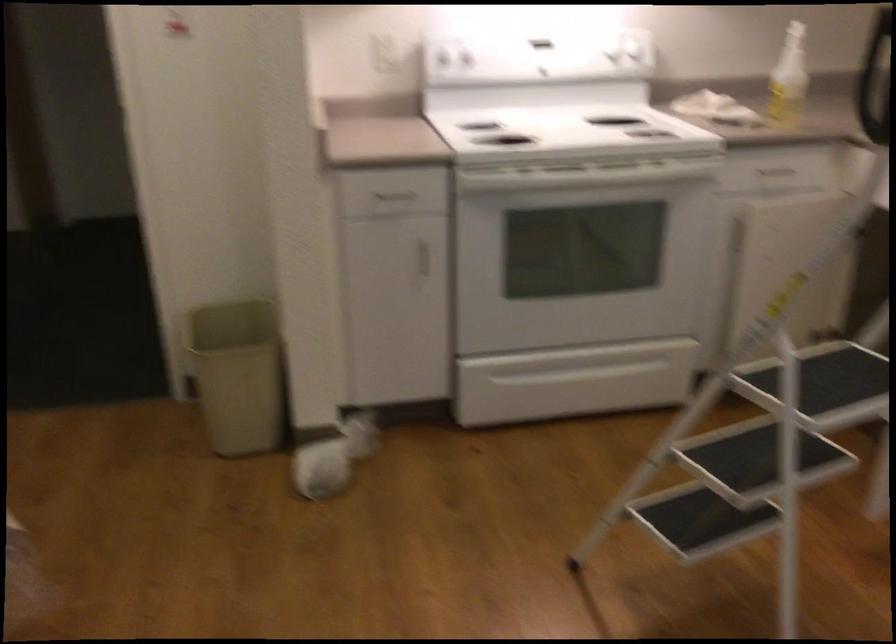
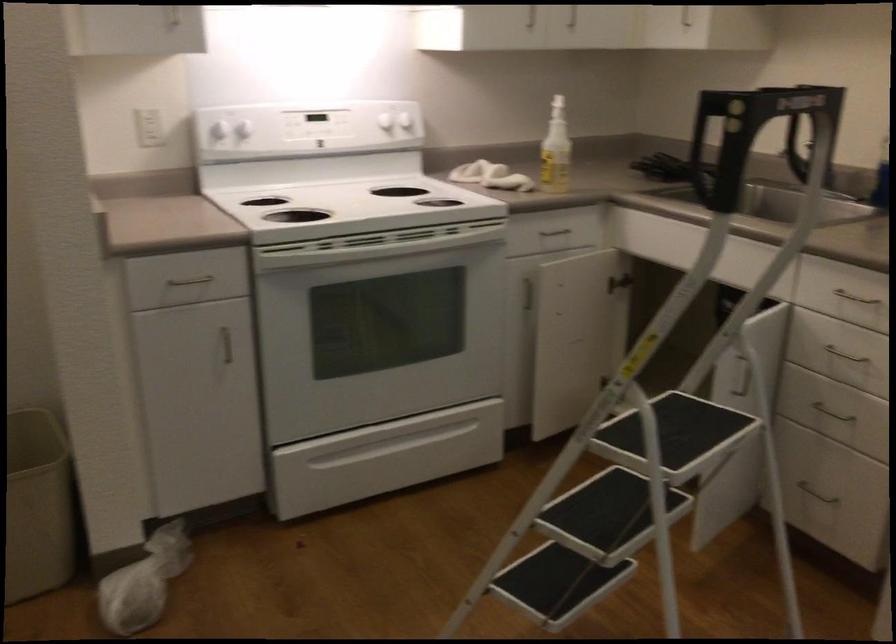
In the second image, find the point that corresponds to [693,522] in the first image.

(556, 583)